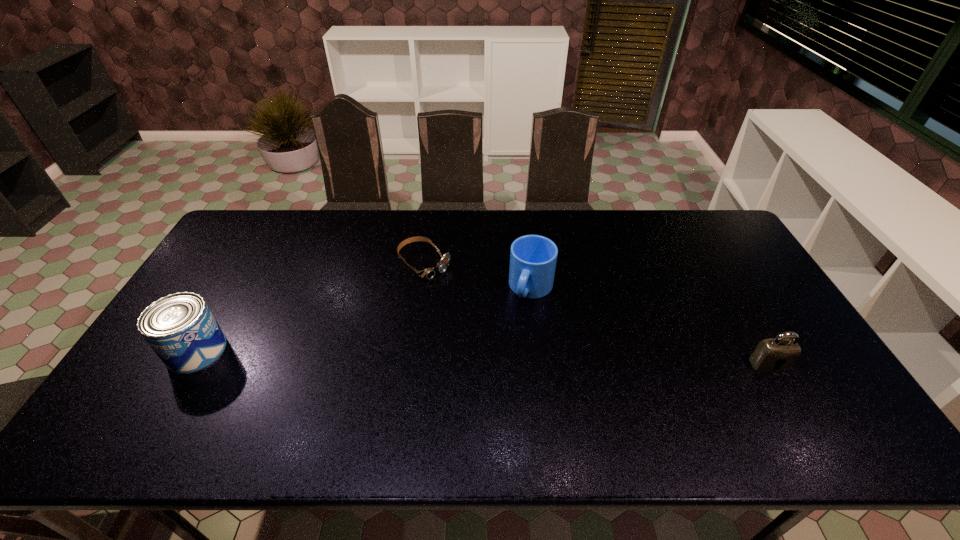
Locate an element on the screen. free spot between the can and the padlock is located at coordinates (483, 357).

Identify the location of object that is the second nearest to the mug. This screenshot has width=960, height=540. (778, 354).

You are a GUI agent. You are given a task and a screenshot of the screen. Output one action in this format:
    pyautogui.click(x=<x>, y=<y>)
    Task: Click on the object that stands as the third closest to the rightmost object
    The width and height of the screenshot is (960, 540).
    Given the screenshot: What is the action you would take?
    pyautogui.click(x=180, y=328)

The height and width of the screenshot is (540, 960). Identify the location of free location that satisfies the following two spatial constraints: 1. on the front side of the shortest object; 2. on the left side of the third object from left to right. (421, 289).